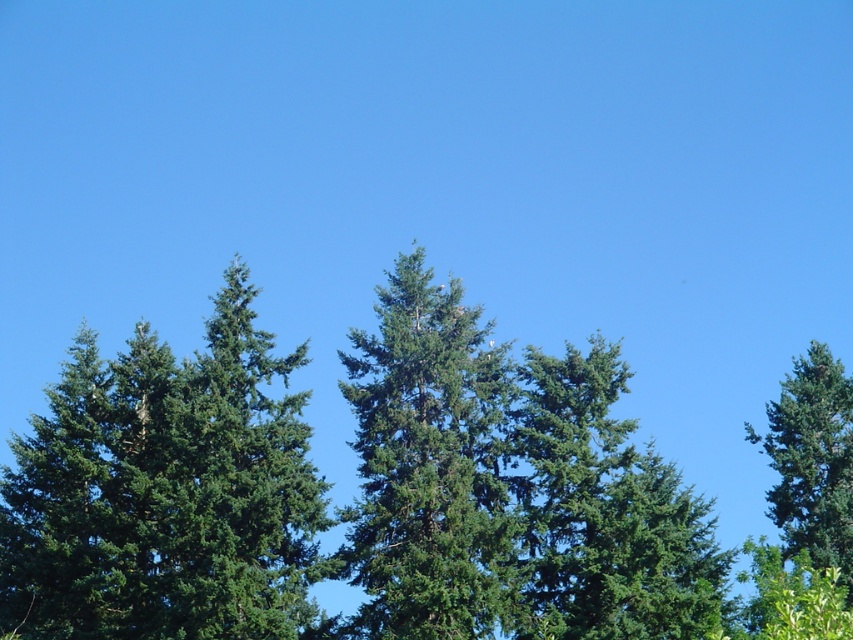
Question: Which object appears closest to the camera in this image?

Choices:
 (A) green needle-like at upper left
 (B) green textured tree at right
 (C) green matte tree at center

Answer: (A)

Question: Which point is closer to the camera?

Choices:
 (A) green needle-like at upper left
 (B) green textured tree at right

Answer: (A)

Question: Is green needle-like at upper left in front of green matte tree at center?

Choices:
 (A) yes
 (B) no

Answer: (A)

Question: Which point is closer to the camera taking this photo?

Choices:
 (A) (837, 486)
 (B) (390, 602)
 (C) (302, 458)

Answer: (B)

Question: Can you confirm if green needle-like at upper left is smaller than green textured tree at right?

Choices:
 (A) yes
 (B) no

Answer: (B)

Question: Does green needle-like at upper left have a greater width compared to green matte tree at center?

Choices:
 (A) yes
 (B) no

Answer: (A)